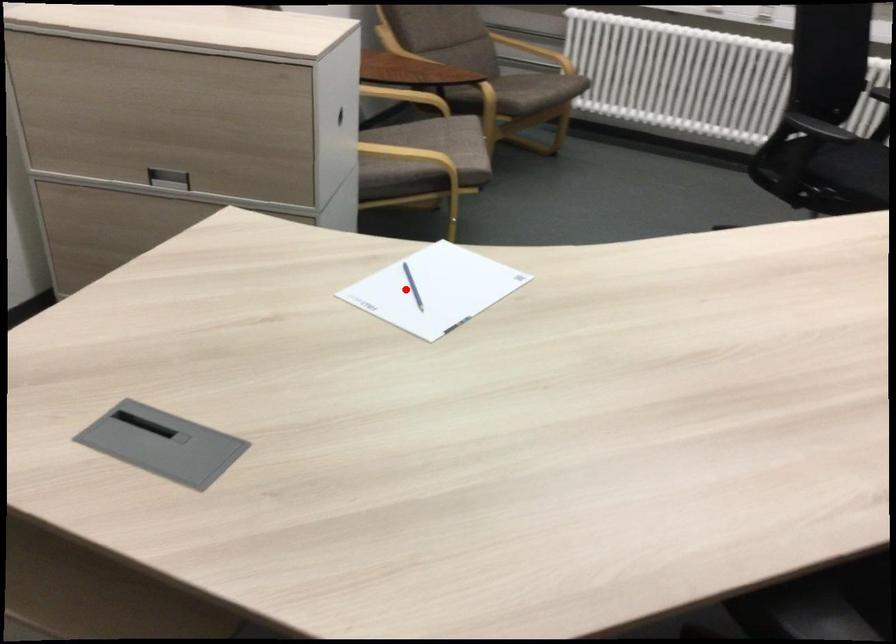
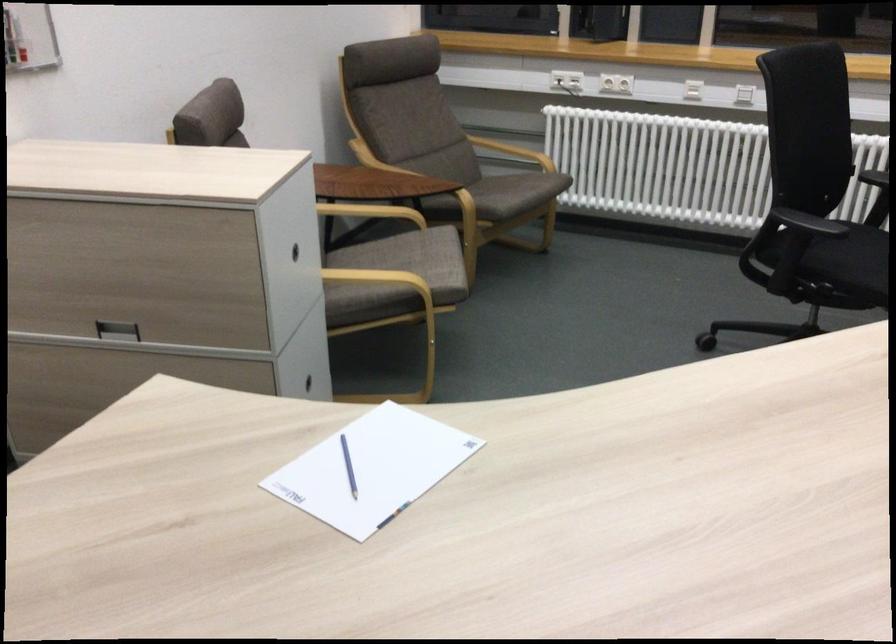
Find the pixel in the second image that matches the highlighted location in the first image.

(348, 466)